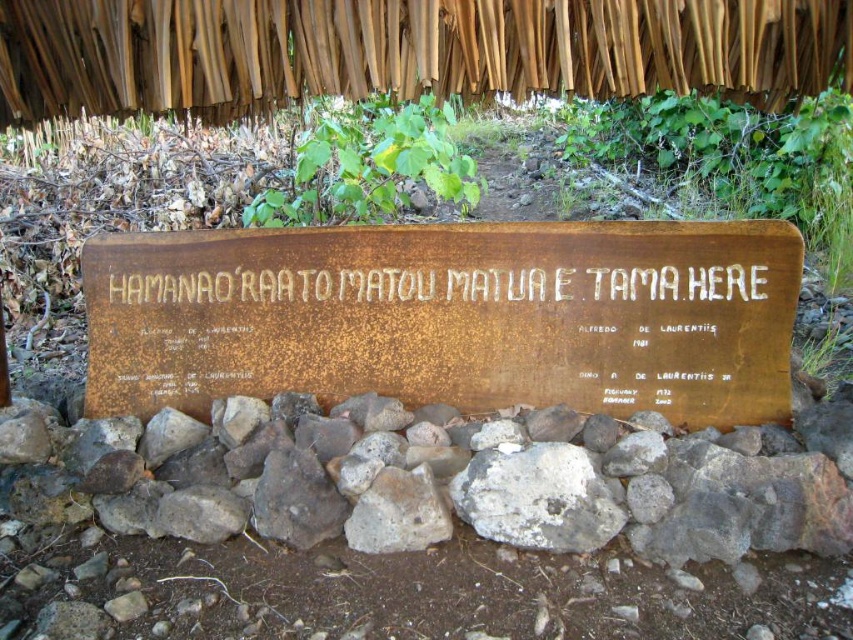
Who is more forward, [344,337] or [520,509]?

Point [520,509]

Describe the element at coordinates (450, 316) in the screenshot. Image resolution: width=853 pixels, height=640 pixels. I see `rusty wood sign at center` at that location.

Find the location of a particular element. rusty wood sign at center is located at coordinates (450, 316).

Can you confirm if rusty wood sign at center is bigger than rusty metal sign at center?

Incorrect, rusty wood sign at center is not larger than rusty metal sign at center.

Which is in front, point (515, 328) or point (393, 465)?

Point (393, 465)

Who is more forward, (433, 336) or (801, 456)?

Point (801, 456)

The width and height of the screenshot is (853, 640). In order to click on rusty wood sign at center in this screenshot , I will do `click(450, 316)`.

Describe the element at coordinates (436, 481) in the screenshot. I see `rusty metal sign at center` at that location.

I want to click on rusty metal sign at center, so click(x=436, y=481).

Identify the location of rusty metal sign at center. Image resolution: width=853 pixels, height=640 pixels. (436, 481).